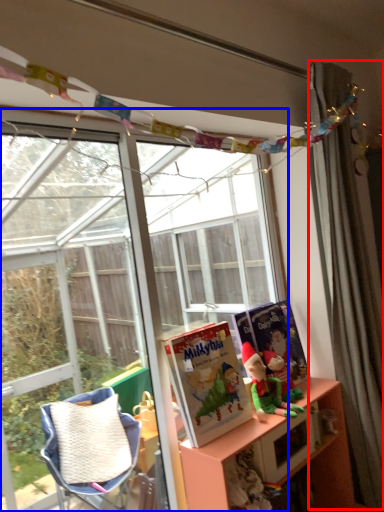
Question: Which of the following is the farthest to the observer, curtain (highlighted by a red box) or window (highlighted by a blue box)?

Choices:
 (A) curtain
 (B) window

Answer: (A)